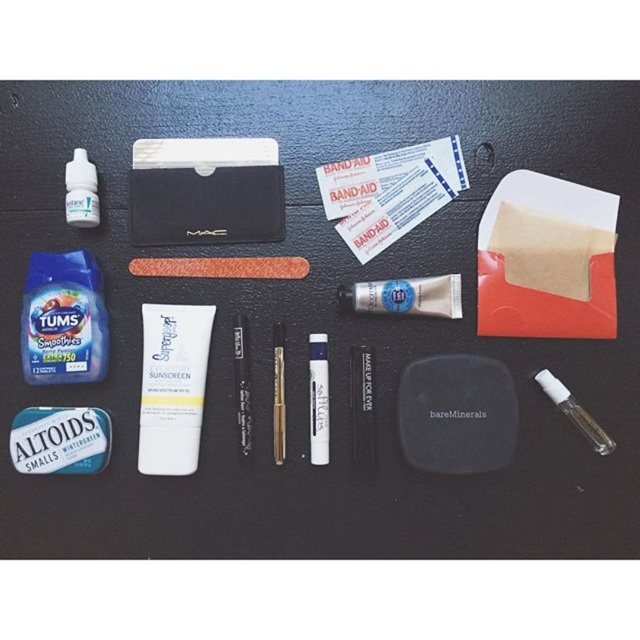
Measure the distance from blue plastic tums at left to clear plastic eye drops at upper left.

14.16 centimeters

Is the position of blue plastic tums at left less distant than that of clear plastic eye drops at upper left?

No, it is behind clear plastic eye drops at upper left.

Between point (84, 272) and point (83, 154), which one is positioned in front?

Point (83, 154) is in front.

I want to click on blue plastic tums at left, so click(64, 320).

Measure the distance between blue metallic altoids at lower left and camera.

The distance of blue metallic altoids at lower left from camera is 1.15 meters.

Which is below, blue metallic altoids at lower left or white matte tube at center?

Answer: Positioned lower is blue metallic altoids at lower left.

Who is more distant from viewer, (49, 422) or (397, 292)?

The point (397, 292) is behind.

Image resolution: width=640 pixels, height=640 pixels. What are the coordinates of `blue metallic altoids at lower left` in the screenshot? It's located at (60, 440).

Between white matte tube at center and clear plastic vial at lower right, which one has more height?

Standing taller between the two is clear plastic vial at lower right.

The width and height of the screenshot is (640, 640). Describe the element at coordinates (406, 296) in the screenshot. I see `white matte tube at center` at that location.

Is point (444, 298) positioned in front of point (561, 387)?

No, (444, 298) is behind (561, 387).

Identify the location of white matte tube at center. (406, 296).